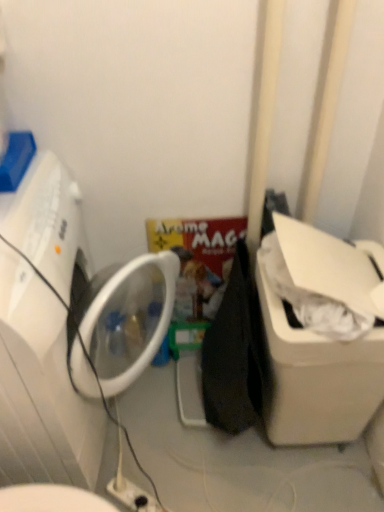
Question: Should I look upward or downward to see white plastic electric outlet at lower center?

Choices:
 (A) up
 (B) down

Answer: (B)

Question: From the image's perspective, is white plastic electric outlet at lower center over white plastic water cooler at right?

Choices:
 (A) yes
 (B) no

Answer: (B)

Question: Could you tell me if white plastic electric outlet at lower center is facing white plastic water cooler at right?

Choices:
 (A) no
 (B) yes

Answer: (A)

Question: From a real-world perspective, is white plastic electric outlet at lower center under white plastic water cooler at right?

Choices:
 (A) yes
 (B) no

Answer: (A)

Question: Is white plastic electric outlet at lower center not near white plastic water cooler at right?

Choices:
 (A) yes
 (B) no

Answer: (B)

Question: Is white plastic electric outlet at lower center positioned beyond the bounds of white plastic water cooler at right?

Choices:
 (A) no
 (B) yes

Answer: (B)

Question: Would you say white plastic electric outlet at lower center contains white plastic water cooler at right?

Choices:
 (A) yes
 (B) no

Answer: (B)

Question: From a real-world perspective, is white plastic water cooler at right under white plastic electric outlet at lower center?

Choices:
 (A) yes
 (B) no

Answer: (B)

Question: Is white plastic water cooler at right at the right side of white plastic electric outlet at lower center?

Choices:
 (A) yes
 (B) no

Answer: (A)

Question: Does white plastic water cooler at right appear on the left side of white plastic electric outlet at lower center?

Choices:
 (A) yes
 (B) no

Answer: (B)

Question: Is white plastic water cooler at right shorter than white plastic electric outlet at lower center?

Choices:
 (A) yes
 (B) no

Answer: (B)

Question: Does white plastic water cooler at right have a larger size compared to white plastic electric outlet at lower center?

Choices:
 (A) no
 (B) yes

Answer: (B)

Question: Is white plastic electric outlet at lower center located within white plastic water cooler at right?

Choices:
 (A) yes
 (B) no

Answer: (B)

Question: Is white plastic electric outlet at lower center taller than white plastic washing machine at left?

Choices:
 (A) no
 (B) yes

Answer: (A)